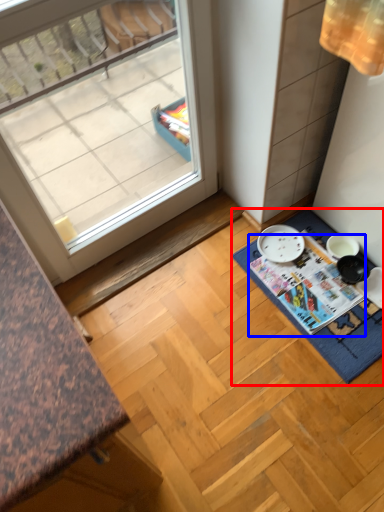
Question: Among these objects, which one is farthest to the camera, bath mat (highlighted by a red box) or magazine (highlighted by a blue box)?

Choices:
 (A) bath mat
 (B) magazine

Answer: (B)